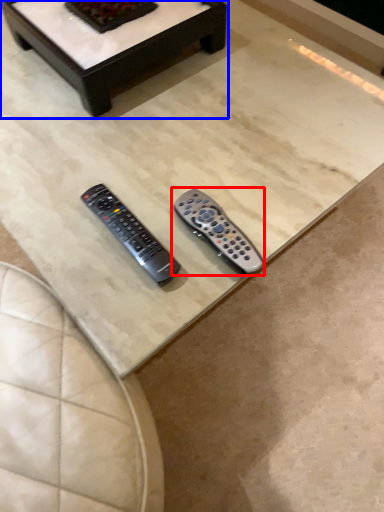
Question: Which of the following is the closest to the observer, remote control (highlighted by a red box) or coffee table (highlighted by a blue box)?

Choices:
 (A) remote control
 (B) coffee table

Answer: (A)